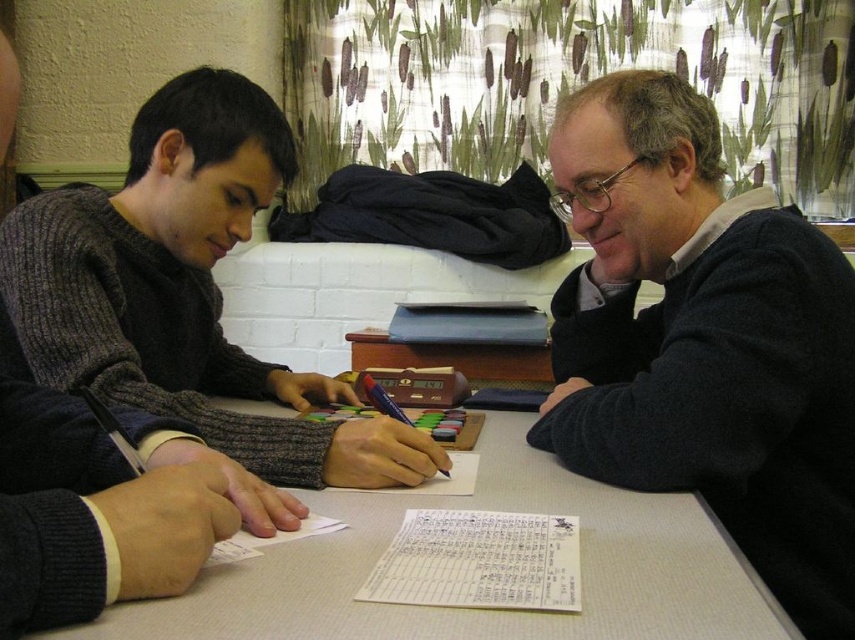
Question: Can you confirm if dark gray sweater at left is positioned to the right of white textured table at center?

Choices:
 (A) yes
 (B) no

Answer: (B)

Question: Which point appears closest to the camera in this image?

Choices:
 (A) (444, 536)
 (B) (623, 500)

Answer: (A)

Question: Among these points, which one is nearest to the camera?

Choices:
 (A) (457, 556)
 (B) (492, 637)

Answer: (B)

Question: Does dark gray sweater at left appear under white textured table at center?

Choices:
 (A) yes
 (B) no

Answer: (B)

Question: Among these points, which one is farthest from the camera?

Choices:
 (A) (661, 246)
 (B) (315, 564)
 (C) (272, 150)

Answer: (C)

Question: Does dark blue sweater at right appear on the left side of white paper at center?

Choices:
 (A) yes
 (B) no

Answer: (B)